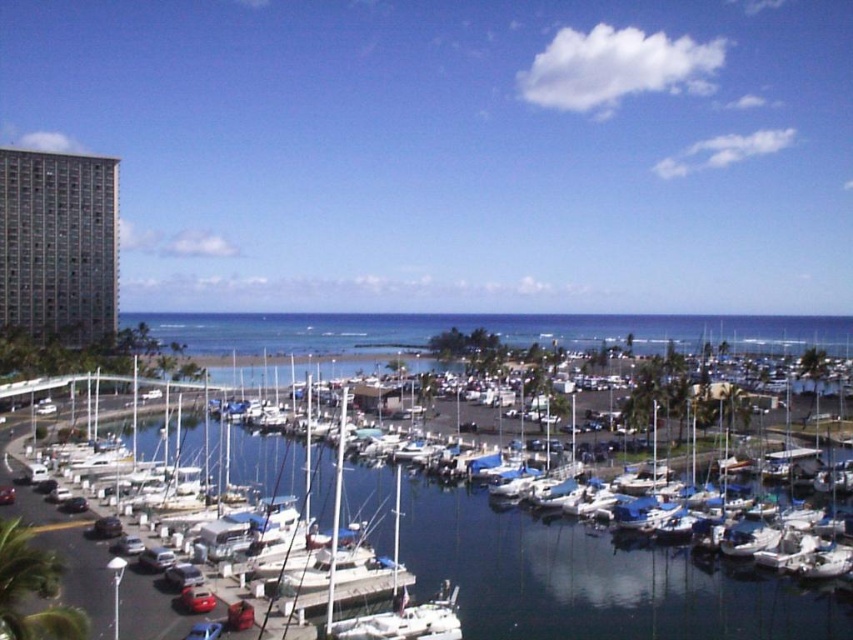
Question: Does gray glass building at left appear on the left side of blue tarpaulin boat at center?

Choices:
 (A) yes
 (B) no

Answer: (A)

Question: Which point is farther from the camera taking this photo?

Choices:
 (A) (387, 580)
 (B) (22, 326)

Answer: (B)

Question: Among these objects, which one is farthest from the camera?

Choices:
 (A) blue tarpaulin boat at center
 (B) gray glass building at left

Answer: (B)

Question: Is gray glass building at left bigger than blue tarpaulin boat at center?

Choices:
 (A) yes
 (B) no

Answer: (B)

Question: Which point is farther to the camera?

Choices:
 (A) (51, 186)
 (B) (86, 586)

Answer: (A)

Question: Is gray glass building at left closer to the viewer compared to blue tarpaulin boat at center?

Choices:
 (A) yes
 (B) no

Answer: (B)